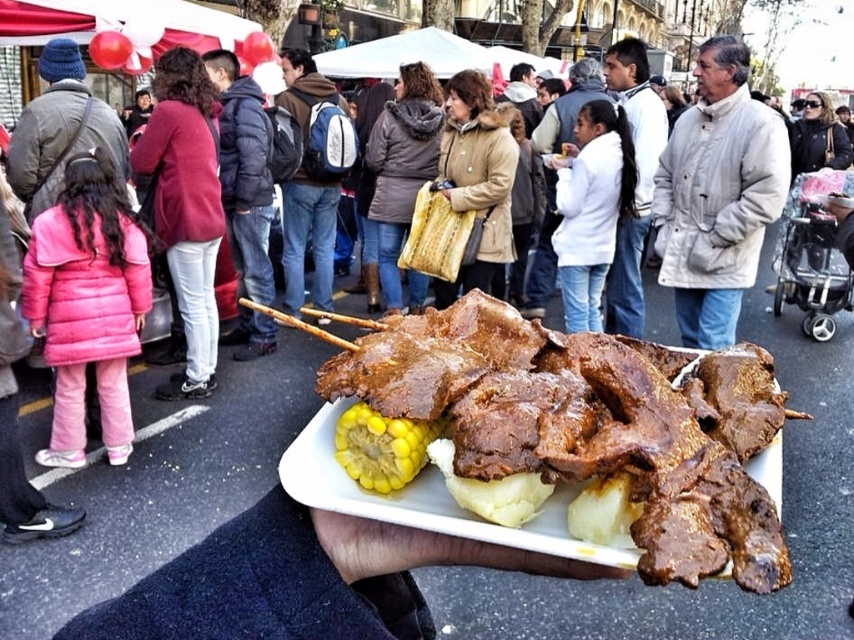
Question: Is brown glossy meat at center thinner than light beige puffy coat at upper right?

Choices:
 (A) yes
 (B) no

Answer: (A)

Question: Is brown glossy meat at center thinner than light beige puffy coat at upper right?

Choices:
 (A) yes
 (B) no

Answer: (A)

Question: Which point is farther from the camera taking this photo?

Choices:
 (A) (671, 433)
 (B) (671, 269)

Answer: (B)

Question: Can you confirm if brown glossy meat at center is bigger than light beige puffy coat at upper right?

Choices:
 (A) yes
 (B) no

Answer: (B)

Question: Which point appears farthest from the camera in this image?

Choices:
 (A) (740, 289)
 (B) (535, 468)

Answer: (A)